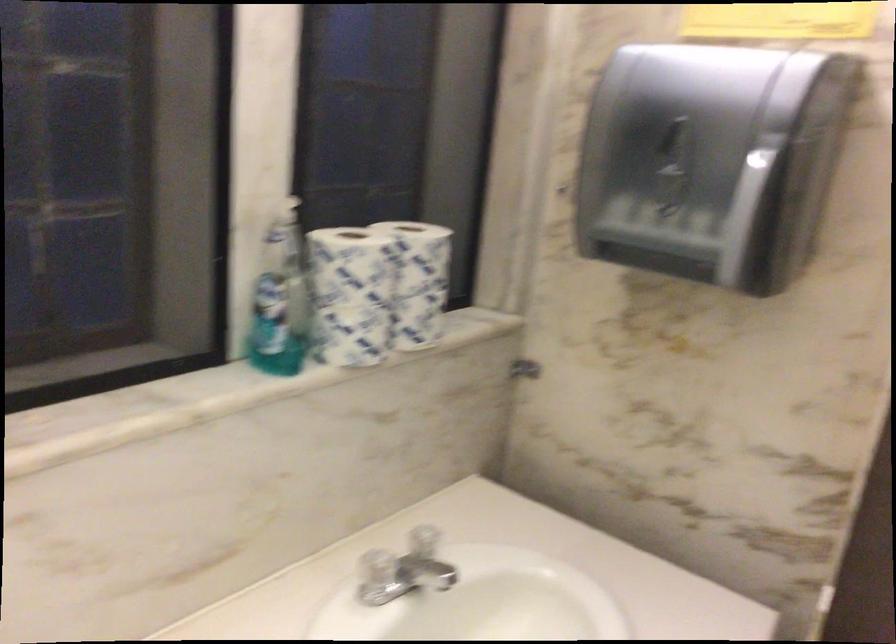
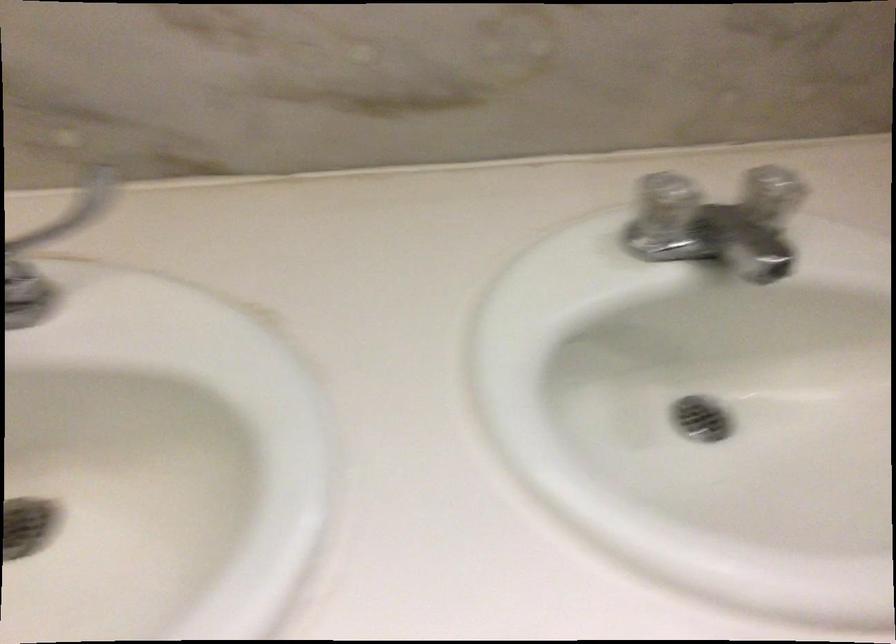
Based on the continuous images, in which direction is the camera rotating?

The camera rotated toward left-down.